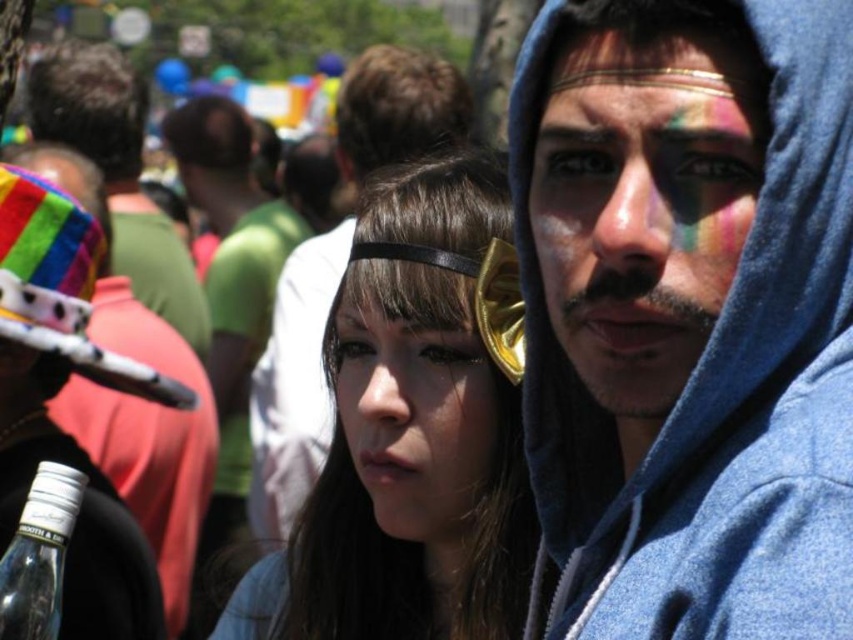
Question: Which object appears closest to the camera in this image?

Choices:
 (A) clear glass bottle at lower left
 (B) rainbow fabric headdress at upper left
 (C) rainbow painted face at center

Answer: (A)

Question: Does blue fleece hoodie at center come behind matte black hair at center?

Choices:
 (A) yes
 (B) no

Answer: (B)

Question: Does matte black hat at center have a smaller size compared to clear glass bottle at lower left?

Choices:
 (A) no
 (B) yes

Answer: (A)

Question: Which object is farther from the camera taking this photo?

Choices:
 (A) rainbow fabric hat at left
 (B) matte black headband at center
 (C) blue fleece hoodie at center
 (D) matte black hair at center

Answer: (A)

Question: Where is matte black hat at center located in relation to clear glass bottle at lower left in the image?

Choices:
 (A) below
 (B) above

Answer: (B)

Question: Which point is closer to the camera taking this photo?

Choices:
 (A) 729,179
 (B) 4,602
 (C) 396,504
 (D) 468,339

Answer: (B)